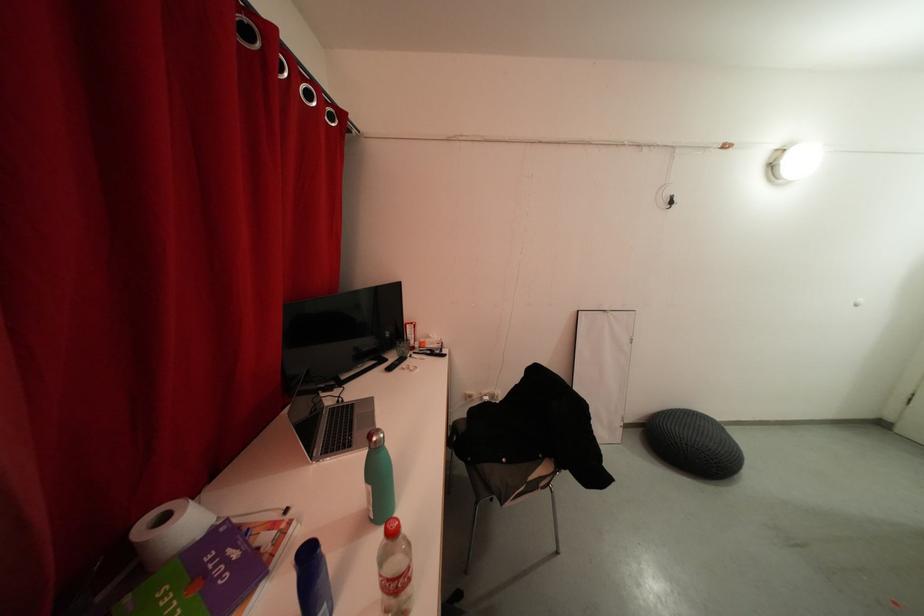
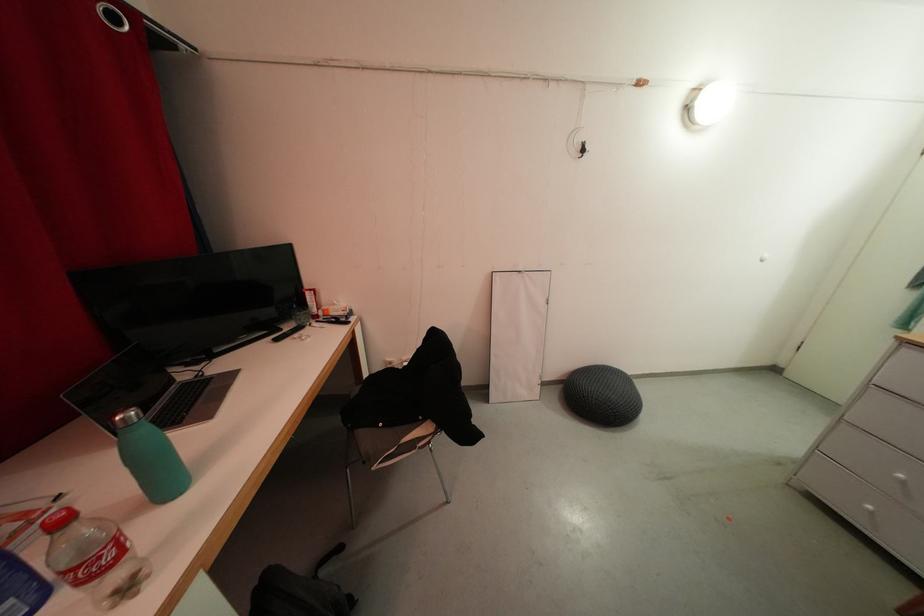
Where in the second image is the point corresponding to [396,362] from the first image?

(293, 331)